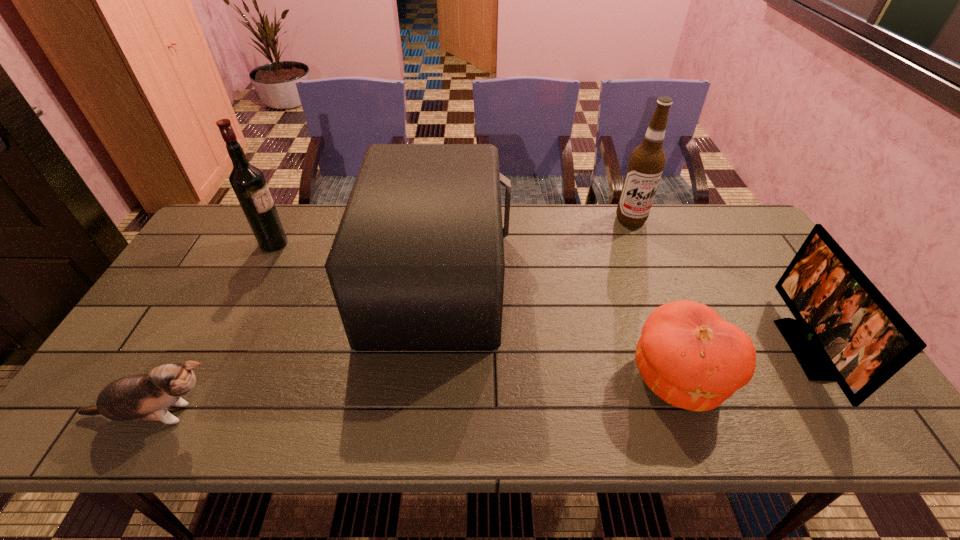
The height and width of the screenshot is (540, 960). I want to click on alcohol, so click(647, 161).

Locate an element on the screen. wine bottle is located at coordinates (248, 182).

Locate an element on the screen. This screenshot has width=960, height=540. microwave oven is located at coordinates (417, 264).

Identify the location of the rightmost object. Image resolution: width=960 pixels, height=540 pixels. (845, 330).

Where is `pumpkin`? Image resolution: width=960 pixels, height=540 pixels. pumpkin is located at coordinates (690, 357).

Locate an element on the screen. This screenshot has width=960, height=540. cat is located at coordinates (146, 397).

Where is `vacant space located on the label of the alcohol`? This screenshot has width=960, height=540. vacant space located on the label of the alcohol is located at coordinates (654, 279).

Locate an element on the screen. vacant space located 0.220m on the front and back of the wine bottle is located at coordinates (357, 244).

The width and height of the screenshot is (960, 540). What are the coordinates of `free space located 0.340m on the front-facing side of the fourth object from right to left` in the screenshot? It's located at (626, 279).

Locate an element on the screen. free space located 0.220m on the front-facing side of the monitor is located at coordinates (703, 349).